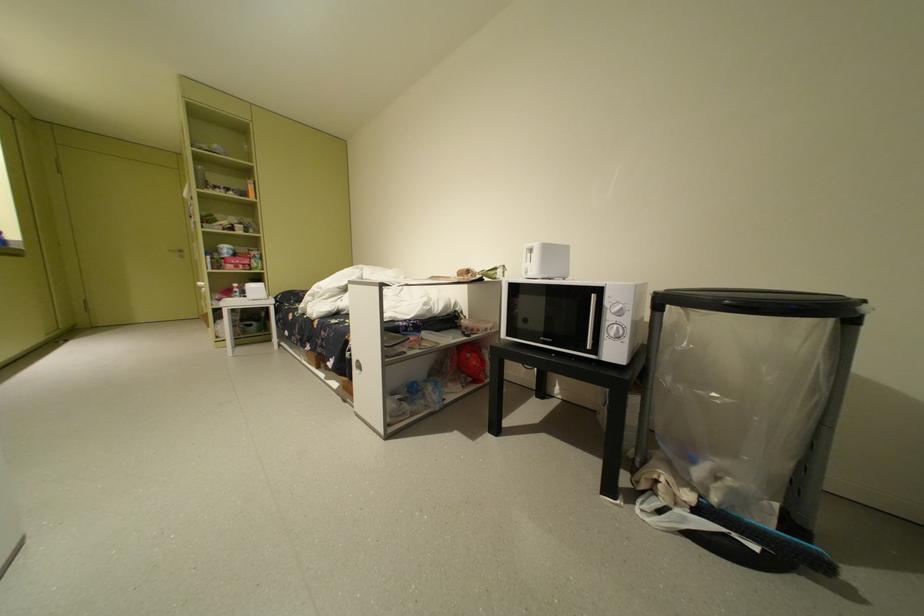
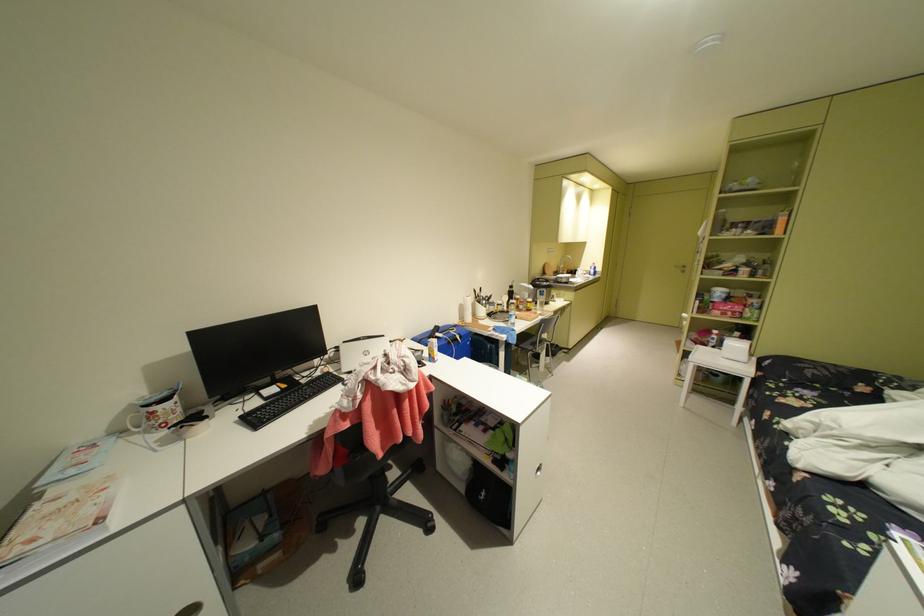
Locate, in the second image, the point that corresponds to pixel 249 257 in the first image.

(740, 304)